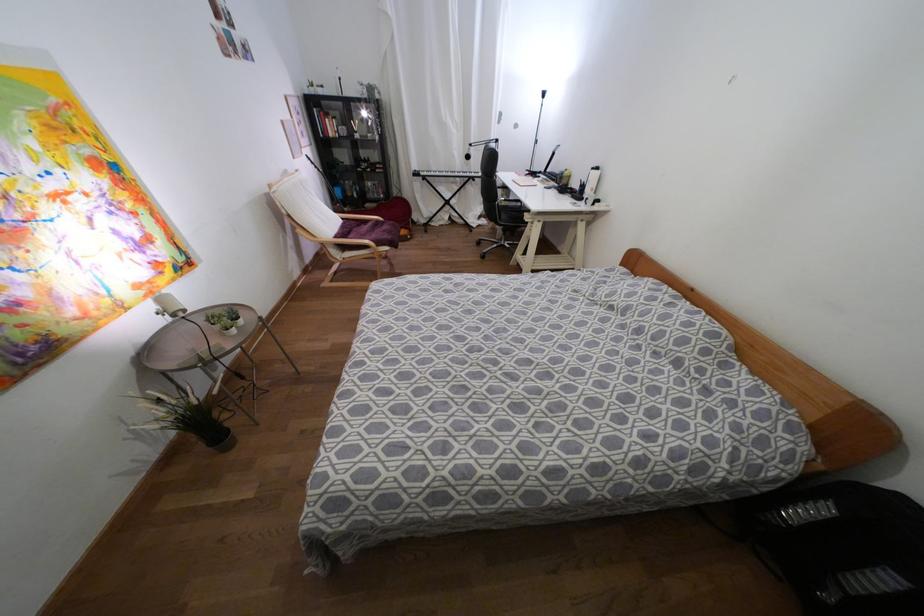
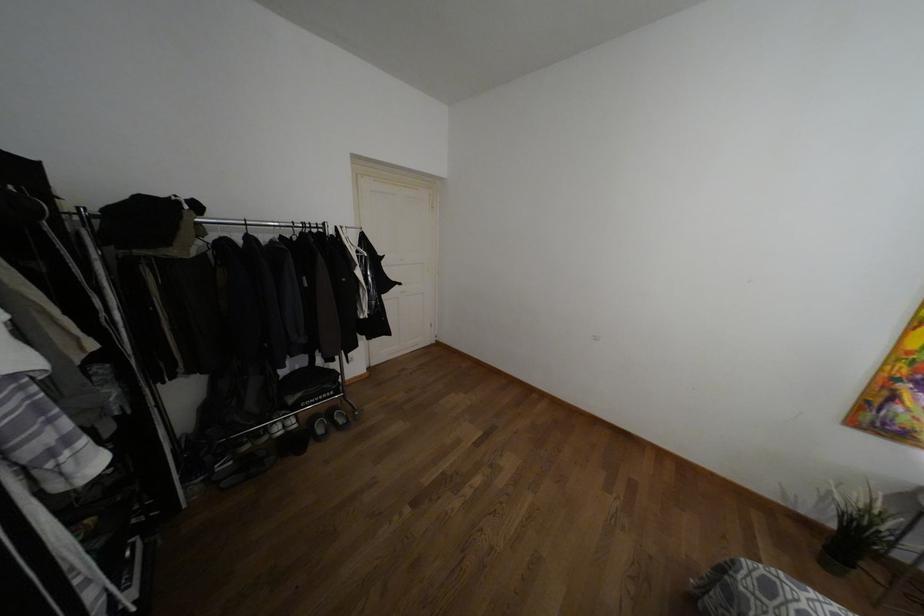
Where in the second image is the point corresponding to point 335,503 from the first image?

(769, 588)